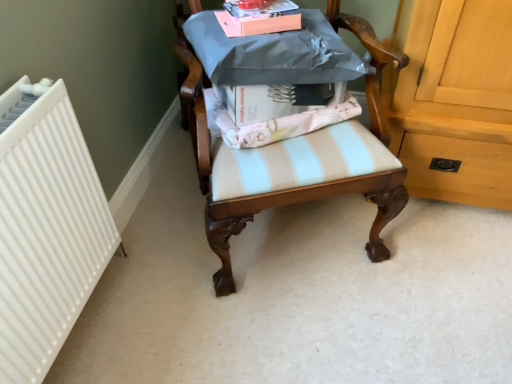
Question: In the image, is wooden chair at center positioned in front of or behind white ribbed radiator at left?

Choices:
 (A) front
 (B) behind

Answer: (A)

Question: In the image, is wooden chair at center on the left side or the right side of white ribbed radiator at left?

Choices:
 (A) left
 (B) right

Answer: (B)

Question: Which is nearer to the white ribbed radiator at left?

Choices:
 (A) wooden chair at center
 (B) pink matte box at upper center

Answer: (A)

Question: Considering the real-world distances, which object is farthest from the wooden chair at center?

Choices:
 (A) white ribbed radiator at left
 (B) pink matte box at upper center

Answer: (A)